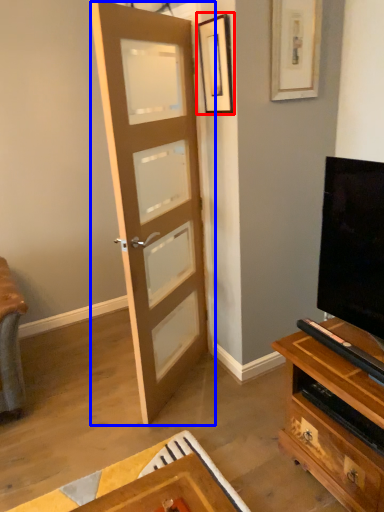
Question: Which point is further to the camera, picture frame (highlighted by a red box) or door (highlighted by a blue box)?

Choices:
 (A) picture frame
 (B) door

Answer: (A)